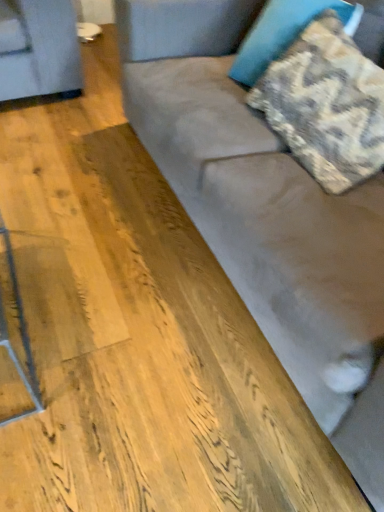
Question: Considering the relative sizes of suede couch at center and camouflage fabric pillow at upper right, which is the second pillow from bottom to top, in the image provided, is suede couch at center shorter than camouflage fabric pillow at upper right, which is the second pillow from bottom to top,?

Choices:
 (A) no
 (B) yes

Answer: (A)

Question: Does suede couch at center appear on the right side of camouflage fabric pillow at upper right, which is the second pillow from bottom to top?

Choices:
 (A) no
 (B) yes

Answer: (B)

Question: Is suede couch at center facing away from camouflage fabric pillow at upper right, which is the second pillow from bottom to top?

Choices:
 (A) yes
 (B) no

Answer: (A)

Question: Does suede couch at center have a greater height compared to camouflage fabric pillow at upper right, which appears as the first pillow when viewed from the top?

Choices:
 (A) no
 (B) yes

Answer: (B)

Question: Is suede couch at center bigger than camouflage fabric pillow at upper right, which is the second pillow from bottom to top?

Choices:
 (A) yes
 (B) no

Answer: (A)

Question: Is camouflage fabric pillow at upper right, which appears as the first pillow when viewed from the top, spatially inside textured beige pillow at upper right, which is the 1th pillow in bottom-to-top order, or outside of it?

Choices:
 (A) inside
 (B) outside

Answer: (B)

Question: Is camouflage fabric pillow at upper right, which appears as the first pillow when viewed from the top, taller or shorter than textured beige pillow at upper right, which is the 1th pillow in bottom-to-top order?

Choices:
 (A) tall
 (B) short

Answer: (A)

Question: In the image, is camouflage fabric pillow at upper right, which appears as the first pillow when viewed from the top, positioned in front of or behind textured beige pillow at upper right, which is the 1th pillow in bottom-to-top order?

Choices:
 (A) front
 (B) behind

Answer: (B)

Question: From the image's perspective, relative to textured beige pillow at upper right, positioned as the 2th pillow in top-to-bottom order, is camouflage fabric pillow at upper right, which appears as the first pillow when viewed from the top, above or below?

Choices:
 (A) below
 (B) above

Answer: (B)

Question: Is camouflage fabric pillow at upper right, which appears as the first pillow when viewed from the top, spatially inside suede couch at center, or outside of it?

Choices:
 (A) inside
 (B) outside

Answer: (A)

Question: From the image's perspective, is camouflage fabric pillow at upper right, which is the second pillow from bottom to top, positioned above or below suede couch at center?

Choices:
 (A) below
 (B) above

Answer: (B)

Question: Based on their sizes in the image, would you say camouflage fabric pillow at upper right, which appears as the first pillow when viewed from the top, is bigger or smaller than suede couch at center?

Choices:
 (A) small
 (B) big

Answer: (A)

Question: Considering the positions of camouflage fabric pillow at upper right, which appears as the first pillow when viewed from the top, and suede couch at center in the image, is camouflage fabric pillow at upper right, which appears as the first pillow when viewed from the top, taller or shorter than suede couch at center?

Choices:
 (A) tall
 (B) short

Answer: (B)

Question: In terms of width, does textured beige pillow at upper right, which is the 1th pillow in bottom-to-top order, look wider or thinner when compared to camouflage fabric pillow at upper right, which appears as the first pillow when viewed from the top?

Choices:
 (A) thin
 (B) wide

Answer: (B)

Question: From their relative heights in the image, would you say textured beige pillow at upper right, which is the 1th pillow in bottom-to-top order, is taller or shorter than camouflage fabric pillow at upper right, which is the second pillow from bottom to top?

Choices:
 (A) tall
 (B) short

Answer: (B)